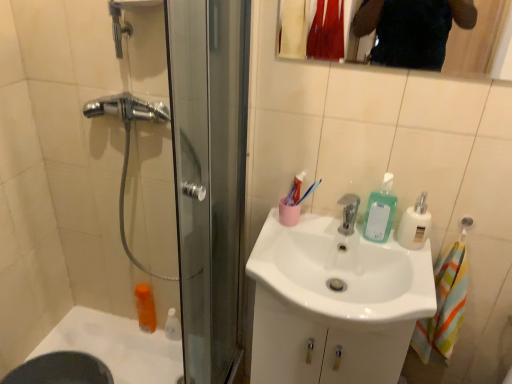
This screenshot has width=512, height=384. In order to click on vacant area in front of translucent plastic soap dispenser at sink right, arranged as the 2th soap dispenser when viewed from the right in this screenshot , I will do `click(404, 265)`.